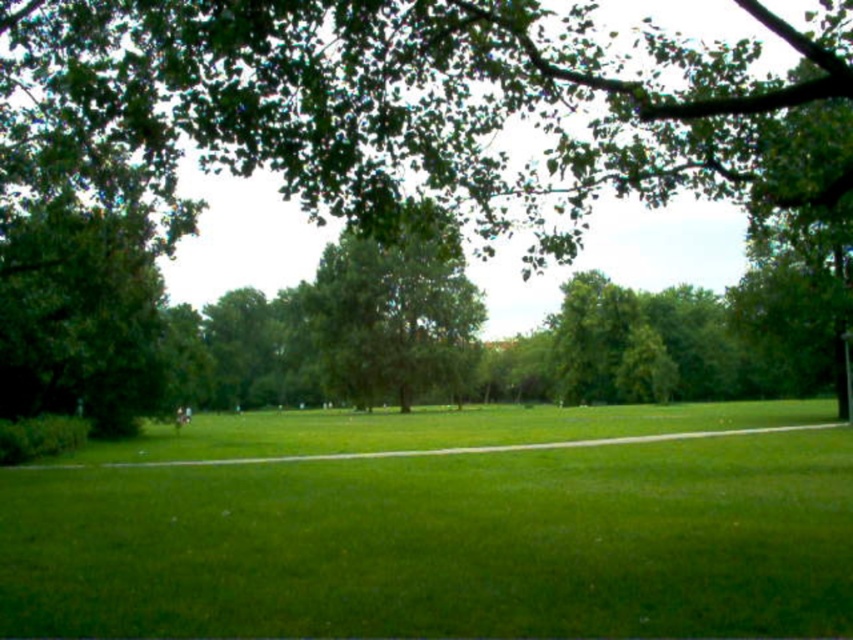
In the scene shown: Is green leafy tree at upper center further to camera compared to green leafy tree at left?

No.

Is green leafy tree at upper center wider than green leafy tree at left?

Indeed, green leafy tree at upper center has a greater width compared to green leafy tree at left.

What do you see at coordinates (376, 108) in the screenshot? I see `green leafy tree at upper center` at bounding box center [376, 108].

The height and width of the screenshot is (640, 853). I want to click on green leafy tree at upper center, so click(x=376, y=108).

Can you confirm if green leafy tree at left is thinner than green leafy tree at center?

Correct, green leafy tree at left's width is less than green leafy tree at center's.

Between green leafy tree at left and green leafy tree at center, which one appears on the left side from the viewer's perspective?

green leafy tree at left

Measure the distance between point (84,353) and camera.

The distance of point (84,353) from camera is 33.31 meters.

You are a GUI agent. You are given a task and a screenshot of the screen. Output one action in this format:
    pyautogui.click(x=<x>, y=<y>)
    Task: Click on the green leafy tree at left
    
    Given the screenshot: What is the action you would take?
    pyautogui.click(x=80, y=317)

At what (x,y) coordinates should I click in order to perform the action: click on green leafy tree at upper center. Please return your answer as a coordinate pair (x, y). Looking at the image, I should click on (376, 108).

What do you see at coordinates (376, 108) in the screenshot?
I see `green leafy tree at upper center` at bounding box center [376, 108].

Describe the element at coordinates (376, 108) in the screenshot. The height and width of the screenshot is (640, 853). I see `green leafy tree at upper center` at that location.

I want to click on green leafy tree at upper center, so click(x=376, y=108).